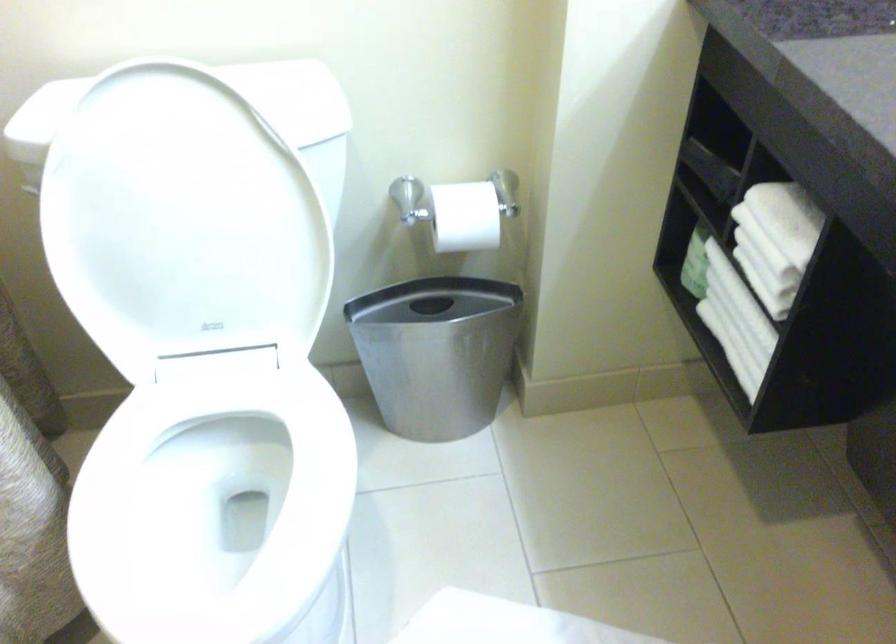
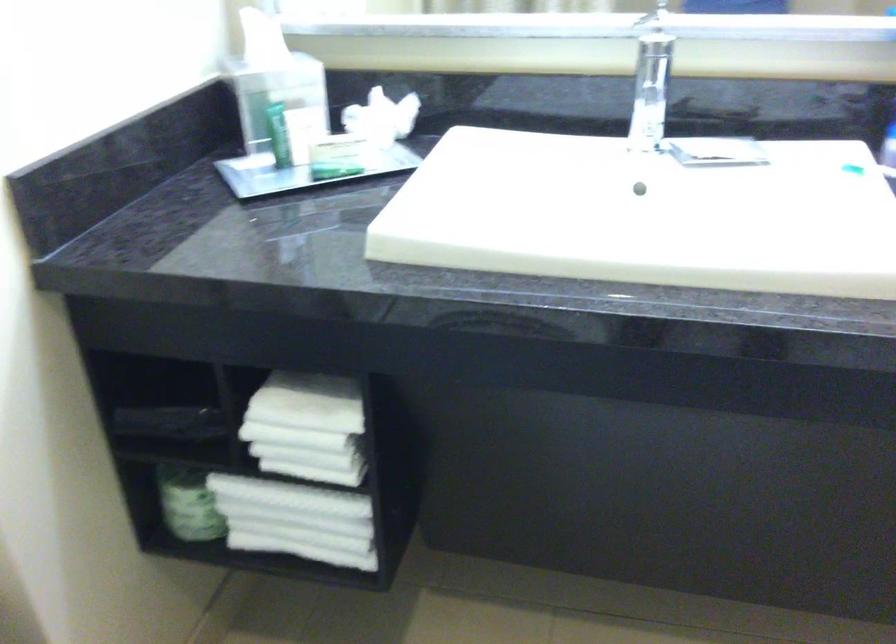
Where in the second image is the point corresponding to the point at 693,254 from the first image?

(188, 504)